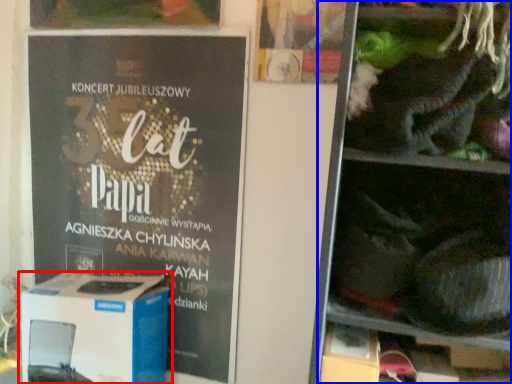
Question: Which of the following is the farthest to the observer, box (highlighted by a red box) or shelf (highlighted by a blue box)?

Choices:
 (A) box
 (B) shelf

Answer: (A)